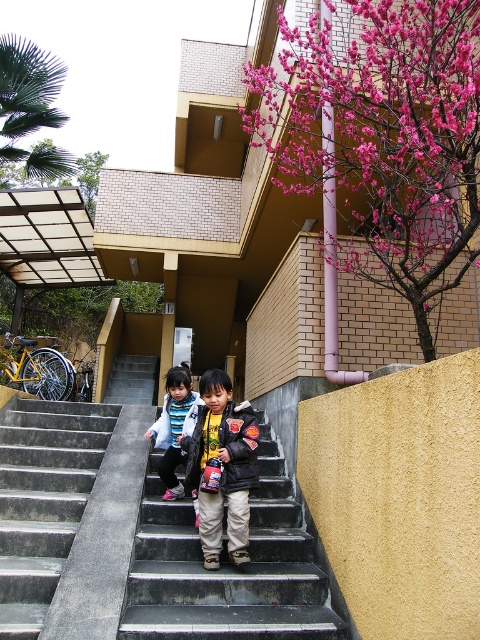
You are a photographer trying to capture both the concrete stairs at center and the striped fleece jacket at center in a single shot. Given that the camera can only focus on objects within a 1.5 meter width, will both objects fit in the frame if the camera is positioned to include both?

The concrete stairs at center is larger in size than striped fleece jacket at center. Since the camera can focus on objects within a 1.5 meter width, and the stairs are larger, they may extend beyond the frame, making it difficult to capture both fully. Adjust the camera angle or position to ensure both fit within the 1.5 meter width.

You are a delivery person trying to reach the building entrance. The concrete stairs at center and the striped fleece jacket at center are in your path. Which object should you move around to reach the entrance?

You should move around the striped fleece jacket at center because the concrete stairs at center is positioned on the left side of it, meaning the jacket is closer to the entrance path.